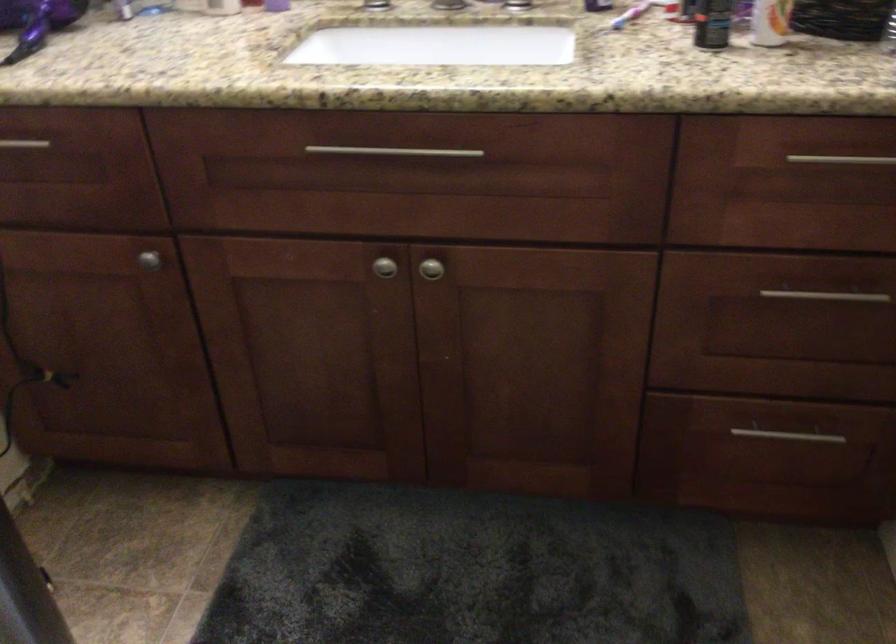
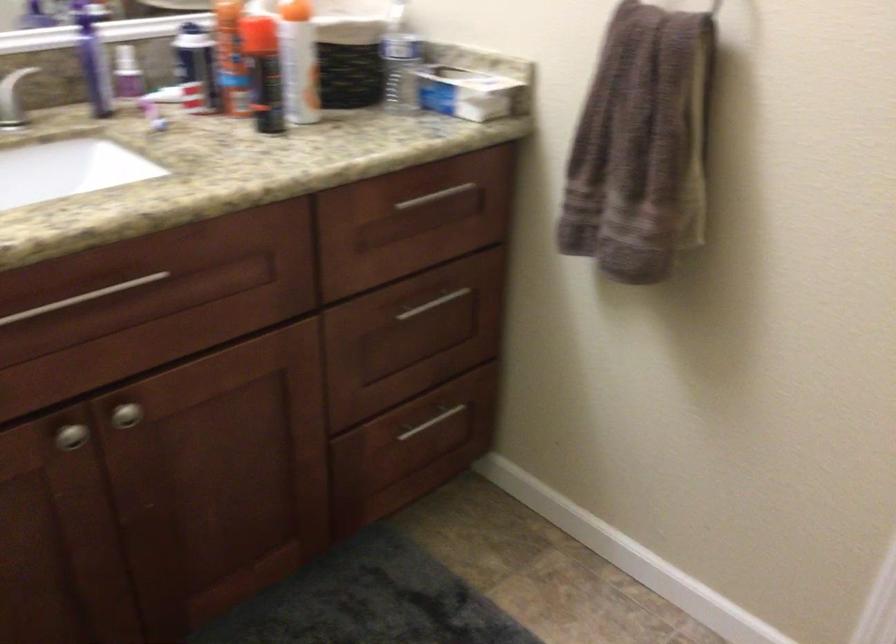
The point at (793,436) is marked in the first image. Where is the corresponding point in the second image?

(432, 422)